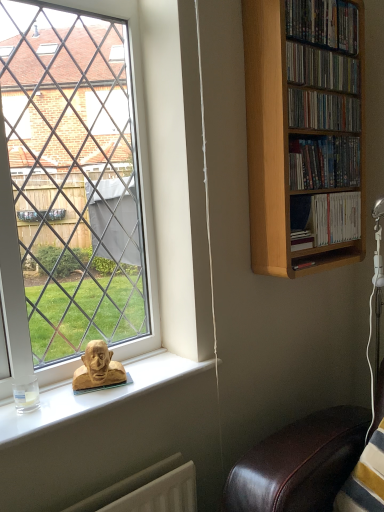
Question: Can you confirm if translucent glass coffee cup at lower left is smaller than wooden shelf at upper right, which is counted as the fourth book, starting from the bottom?

Choices:
 (A) yes
 (B) no

Answer: (A)

Question: From a real-world perspective, is translucent glass coffee cup at lower left located beneath wooden shelf at upper right, which is counted as the fourth book, starting from the bottom?

Choices:
 (A) no
 (B) yes

Answer: (B)

Question: Is translucent glass coffee cup at lower left shorter than wooden shelf at upper right, which is counted as the fourth book, starting from the bottom?

Choices:
 (A) yes
 (B) no

Answer: (A)

Question: Can you confirm if translucent glass coffee cup at lower left is thinner than wooden shelf at upper right, which is counted as the fourth book, starting from the bottom?

Choices:
 (A) yes
 (B) no

Answer: (A)

Question: Would you say wooden shelf at upper right, marked as the second book in a top-to-bottom arrangement, is part of translucent glass coffee cup at lower left's contents?

Choices:
 (A) yes
 (B) no

Answer: (B)

Question: Would you say white paperbacks at upper right, which is counted as the fifth book, starting from the top, is to the left or to the right of wooden sculpture at window in the picture?

Choices:
 (A) right
 (B) left

Answer: (A)

Question: From a real-world perspective, relative to wooden sculpture at window, is white paperbacks at upper right, the first book in the bottom-to-top sequence, vertically above or below?

Choices:
 (A) above
 (B) below

Answer: (A)

Question: Is white paperbacks at upper right, which is counted as the fifth book, starting from the top, wider or thinner than wooden sculpture at window?

Choices:
 (A) wide
 (B) thin

Answer: (A)

Question: Does point tap(311, 224) appear closer or farther from the camera than point tap(94, 367)?

Choices:
 (A) closer
 (B) farther

Answer: (B)

Question: From a real-world perspective, is wooden sculpture at window physically located above or below matte wooden shelf at upper right, the 2th book from the bottom?

Choices:
 (A) above
 (B) below

Answer: (B)

Question: Considering the positions of wooden sculpture at window and matte wooden shelf at upper right, the 2th book from the bottom, in the image, is wooden sculpture at window taller or shorter than matte wooden shelf at upper right, the 2th book from the bottom,?

Choices:
 (A) tall
 (B) short

Answer: (B)

Question: Is wooden sculpture at window wider or thinner than matte wooden shelf at upper right, which ranks as the fourth book in top-to-bottom order?

Choices:
 (A) thin
 (B) wide

Answer: (A)

Question: Is wooden sculpture at window to the left or to the right of matte wooden shelf at upper right, which ranks as the fourth book in top-to-bottom order, in the image?

Choices:
 (A) left
 (B) right

Answer: (A)

Question: From the image's perspective, is wooden dvds at upper right, which is counted as the 5th book, starting from the bottom, located above or below matte wooden shelf at upper right, the 2th book from the bottom?

Choices:
 (A) below
 (B) above

Answer: (B)

Question: Is point (352, 24) positioned closer to the camera than point (307, 144)?

Choices:
 (A) farther
 (B) closer

Answer: (A)